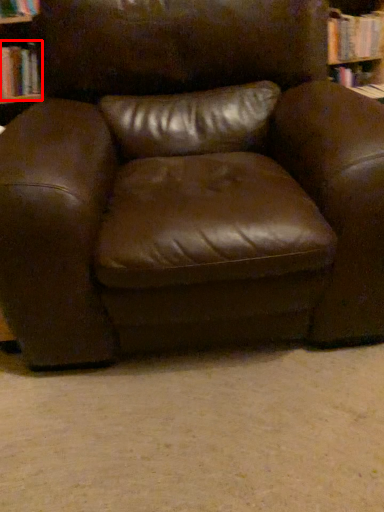
Question: From the image, what is the correct spatial relationship of book (annotated by the red box) in relation to chair?

Choices:
 (A) left
 (B) right

Answer: (A)